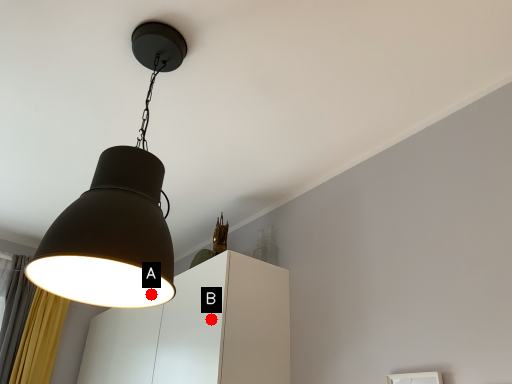
Question: Two points are circled on the image, labeled by A and B beside each circle. Which point is further to the camera?

Choices:
 (A) A is further
 (B) B is further

Answer: (B)